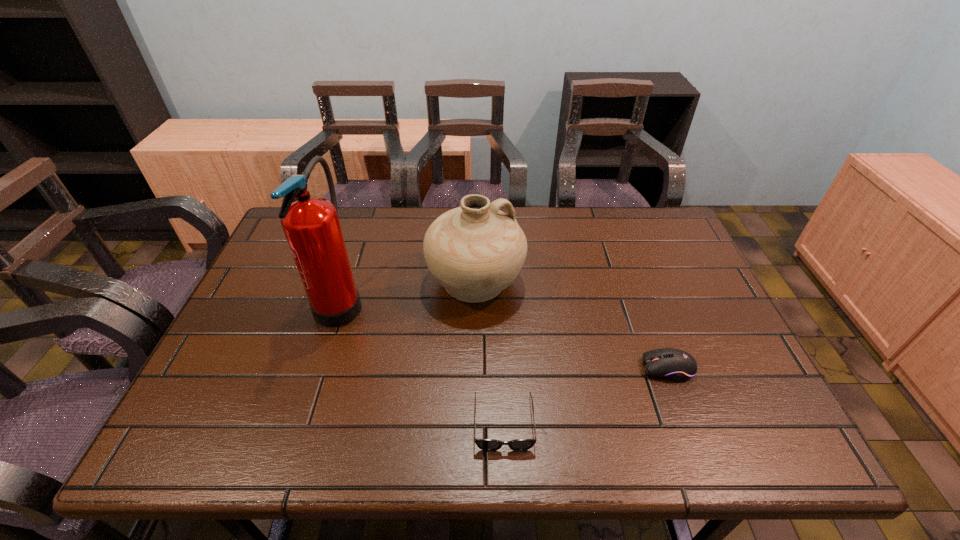
Identify the location of object that is at the far edge. The height and width of the screenshot is (540, 960). (475, 251).

The height and width of the screenshot is (540, 960). In order to click on object that is positioned at the near edge in this screenshot , I will do pos(484,444).

I want to click on object that is positioned at the right edge, so click(x=676, y=365).

In the image, there is a desktop. Where is `vacant space at the far edge`? This screenshot has width=960, height=540. vacant space at the far edge is located at coordinates (615, 246).

This screenshot has width=960, height=540. In the image, there is a desktop. Find the location of `free region at the near edge`. free region at the near edge is located at coordinates (359, 447).

Identify the location of blank space at the right edge of the desktop. (677, 297).

This screenshot has width=960, height=540. Identify the location of free region at the far left corner. (280, 242).

This screenshot has width=960, height=540. Identify the location of vacant region at the near left corner of the desktop. (211, 418).

At what (x,y) coordinates should I click in order to perform the action: click on free spot at the far right corner of the desktop. Please return your answer as a coordinate pair (x, y). The width and height of the screenshot is (960, 540). Looking at the image, I should click on (654, 231).

Identify the location of free space between the computer mouse and the shortest object. (586, 395).